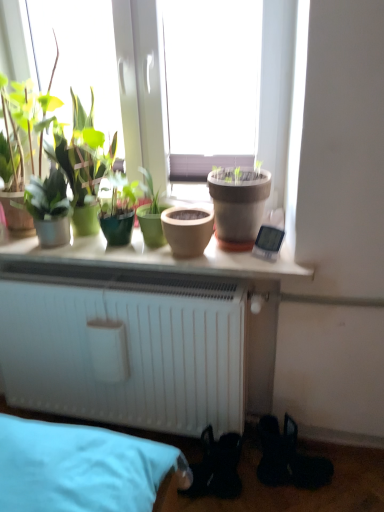
Question: From a real-world perspective, does green matte plant at left, which is counted as the 2th houseplant, starting from the right, sit lower than matte clay pot at center, which is the second flowerpot from right to left?

Choices:
 (A) yes
 (B) no

Answer: (B)

Question: Considering the relative sizes of green matte plant at left, which is counted as the 1th houseplant, starting from the left, and matte clay pot at center, which is the second flowerpot from right to left, in the image provided, is green matte plant at left, which is counted as the 1th houseplant, starting from the left, wider than matte clay pot at center, which is the second flowerpot from right to left,?

Choices:
 (A) no
 (B) yes

Answer: (A)

Question: Considering the relative positions of green matte plant at left, which is counted as the 2th houseplant, starting from the right, and matte clay pot at center, which is the second flowerpot from right to left, in the image provided, is green matte plant at left, which is counted as the 2th houseplant, starting from the right, to the left of matte clay pot at center, which is the second flowerpot from right to left, from the viewer's perspective?

Choices:
 (A) yes
 (B) no

Answer: (A)

Question: Considering the relative positions of green matte plant at left, which is counted as the 1th houseplant, starting from the left, and matte clay pot at center, which is the second flowerpot from right to left, in the image provided, is green matte plant at left, which is counted as the 1th houseplant, starting from the left, to the right of matte clay pot at center, which is the second flowerpot from right to left, from the viewer's perspective?

Choices:
 (A) yes
 (B) no

Answer: (B)

Question: Does green matte plant at left, which is counted as the 1th houseplant, starting from the left, have a smaller size compared to matte clay pot at center, which is the second flowerpot from right to left?

Choices:
 (A) yes
 (B) no

Answer: (B)

Question: From a real-world perspective, is matte clay pot at center, which appears as the second flowerpot when viewed from the left, positioned above or below green matte pot at center, the 2th houseplant when ordered from left to right?

Choices:
 (A) above
 (B) below

Answer: (A)

Question: Considering the positions of matte clay pot at center, which appears as the second flowerpot when viewed from the left, and green matte pot at center, positioned as the first houseplant in right-to-left order, in the image, is matte clay pot at center, which appears as the second flowerpot when viewed from the left, taller or shorter than green matte pot at center, positioned as the first houseplant in right-to-left order,?

Choices:
 (A) tall
 (B) short

Answer: (B)

Question: In the image, is matte clay pot at center, which appears as the second flowerpot when viewed from the left, on the left side or the right side of green matte pot at center, positioned as the first houseplant in right-to-left order?

Choices:
 (A) right
 (B) left

Answer: (A)

Question: Based on their sizes in the image, would you say matte clay pot at center, which appears as the second flowerpot when viewed from the left, is bigger or smaller than green matte pot at center, positioned as the first houseplant in right-to-left order?

Choices:
 (A) big
 (B) small

Answer: (A)

Question: Considering the positions of matte clay pot at center, which appears as the second flowerpot when viewed from the left, and matte clay pot at center, arranged as the 1th flowerpot when viewed from the left, in the image, is matte clay pot at center, which appears as the second flowerpot when viewed from the left, wider or thinner than matte clay pot at center, arranged as the 1th flowerpot when viewed from the left,?

Choices:
 (A) wide
 (B) thin

Answer: (A)

Question: From a real-world perspective, is matte clay pot at center, which appears as the second flowerpot when viewed from the left, above or below matte clay pot at center, which is the second flowerpot from right to left?

Choices:
 (A) above
 (B) below

Answer: (A)

Question: In terms of height, does matte clay pot at center, which appears as the second flowerpot when viewed from the left, look taller or shorter compared to matte clay pot at center, which is the second flowerpot from right to left?

Choices:
 (A) short
 (B) tall

Answer: (B)

Question: Choose the correct answer: Is matte clay pot at center, which appears as the second flowerpot when viewed from the left, inside matte clay pot at center, arranged as the 1th flowerpot when viewed from the left, or outside it?

Choices:
 (A) inside
 (B) outside

Answer: (B)

Question: Would you say matte clay pot at center, which appears as the second flowerpot when viewed from the left, is to the left or to the right of green matte plant at left, which is counted as the 1th houseplant, starting from the left, in the picture?

Choices:
 (A) right
 (B) left

Answer: (A)

Question: From the image's perspective, is matte clay pot at center, which is counted as the first flowerpot, starting from the right, located above or below green matte plant at left, which is counted as the 2th houseplant, starting from the right?

Choices:
 (A) above
 (B) below

Answer: (A)